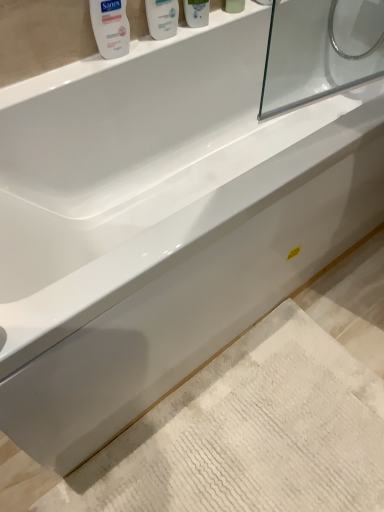
Question: From the image's perspective, is white glossy mouthwash at upper center, the 2th mouthwash from the left, located above white glossy mouthwash at upper left, the fourth mouthwash from the right?

Choices:
 (A) yes
 (B) no

Answer: (A)

Question: Is white glossy mouthwash at upper center, which is the 3th mouthwash in right-to-left order, beside white glossy mouthwash at upper left, which ranks as the 1th mouthwash in left-to-right order?

Choices:
 (A) yes
 (B) no

Answer: (B)

Question: Can we say white glossy mouthwash at upper center, which is the 3th mouthwash in right-to-left order, lies outside white glossy mouthwash at upper left, the fourth mouthwash from the right?

Choices:
 (A) yes
 (B) no

Answer: (A)

Question: Can you confirm if white glossy mouthwash at upper center, the 2th mouthwash from the left, is taller than white glossy mouthwash at upper left, which ranks as the 1th mouthwash in left-to-right order?

Choices:
 (A) yes
 (B) no

Answer: (B)

Question: Is white glossy mouthwash at upper center, which is the 3th mouthwash in right-to-left order, bigger than white glossy mouthwash at upper left, the fourth mouthwash from the right?

Choices:
 (A) yes
 (B) no

Answer: (A)

Question: Relative to white glossy bottle at upper center, marked as the 2th mouthwash in a right-to-left arrangement, is white glossy mouthwash at upper center, the 2th mouthwash from the left, in front or behind?

Choices:
 (A) behind
 (B) front

Answer: (B)

Question: Is point (152, 10) positioned closer to the camera than point (192, 7)?

Choices:
 (A) farther
 (B) closer

Answer: (B)

Question: From a real-world perspective, is white glossy mouthwash at upper center, the 2th mouthwash from the left, physically located above or below white glossy bottle at upper center, marked as the 2th mouthwash in a right-to-left arrangement?

Choices:
 (A) below
 (B) above

Answer: (A)

Question: From the image's perspective, is white glossy mouthwash at upper center, which is the 3th mouthwash in right-to-left order, positioned above or below white glossy bottle at upper center, marked as the 2th mouthwash in a right-to-left arrangement?

Choices:
 (A) above
 (B) below

Answer: (B)

Question: Is white glossy bottle at upper center, the 3th mouthwash when ordered from left to right, taller or shorter than white glossy mouthwash at upper left, the fourth mouthwash from the right?

Choices:
 (A) short
 (B) tall

Answer: (B)

Question: Is point (205, 9) positioned closer to the camera than point (119, 35)?

Choices:
 (A) closer
 (B) farther

Answer: (B)

Question: Based on their sizes in the image, would you say white glossy bottle at upper center, marked as the 2th mouthwash in a right-to-left arrangement, is bigger or smaller than white glossy mouthwash at upper left, which ranks as the 1th mouthwash in left-to-right order?

Choices:
 (A) big
 (B) small

Answer: (A)

Question: Considering the positions of white glossy bottle at upper center, the 3th mouthwash when ordered from left to right, and white glossy mouthwash at upper left, the fourth mouthwash from the right, in the image, is white glossy bottle at upper center, the 3th mouthwash when ordered from left to right, wider or thinner than white glossy mouthwash at upper left, the fourth mouthwash from the right,?

Choices:
 (A) wide
 (B) thin

Answer: (A)

Question: Considering the positions of white textured bath mat at lower center and white glossy bottle at upper center, marked as the 2th mouthwash in a right-to-left arrangement, in the image, is white textured bath mat at lower center bigger or smaller than white glossy bottle at upper center, marked as the 2th mouthwash in a right-to-left arrangement,?

Choices:
 (A) small
 (B) big

Answer: (B)

Question: From a real-world perspective, relative to white glossy bottle at upper center, the 3th mouthwash when ordered from left to right, is white textured bath mat at lower center vertically above or below?

Choices:
 (A) above
 (B) below

Answer: (B)